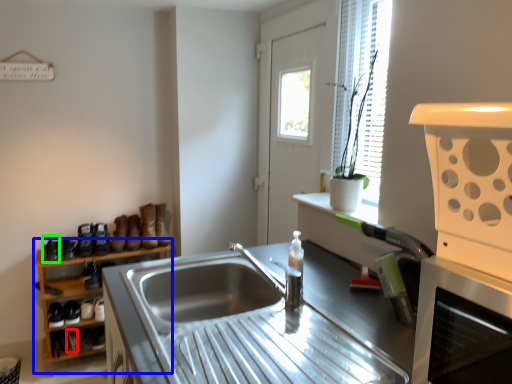
Question: Considering the real-world distances, which object is farthest from shoe (highlighted by a red box)? shelf (highlighted by a blue box) or shoe (highlighted by a green box)?

Choices:
 (A) shelf
 (B) shoe

Answer: (B)